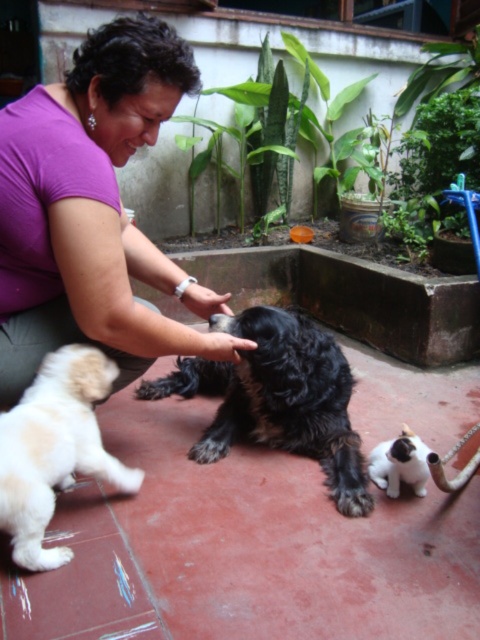
Question: In this image, where is black furry dog at center located relative to white fur cat at lower right?

Choices:
 (A) right
 (B) left

Answer: (B)

Question: Does black furry dog at center appear over white fur cat at lower right?

Choices:
 (A) no
 (B) yes

Answer: (B)

Question: Does black furry dog at center have a greater width compared to light beige fur at lower left?

Choices:
 (A) yes
 (B) no

Answer: (A)

Question: Which object appears closest to the camera in this image?

Choices:
 (A) black furry dog at center
 (B) light beige fur at lower left
 (C) purple fabric at center

Answer: (C)

Question: Which of the following is the closest to the observer?

Choices:
 (A) (409, 452)
 (B) (85, 113)

Answer: (B)

Question: Which object is the farthest from the white fur cat at lower right?

Choices:
 (A) black furry dog at center
 (B) light beige fur at lower left

Answer: (B)